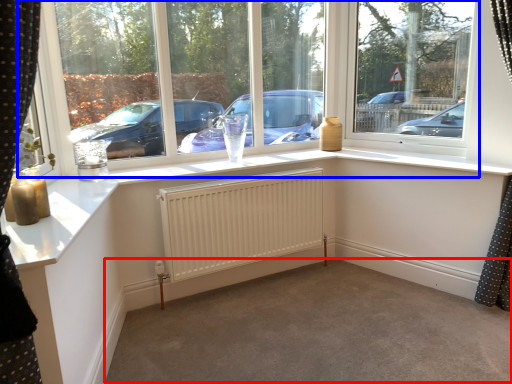
Question: Which object is closer to the camera taking this photo, plain (highlighted by a red box) or window (highlighted by a blue box)?

Choices:
 (A) plain
 (B) window

Answer: (A)